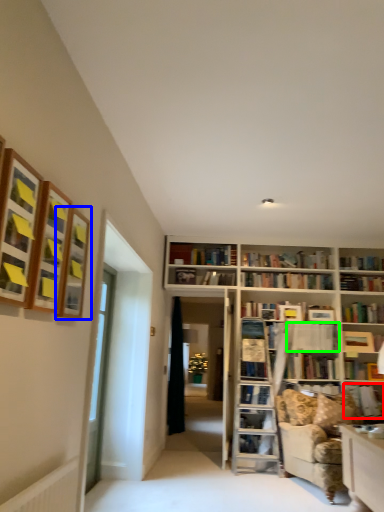
Question: Which is farther away from book (highlighted by a red box)? shelf (highlighted by a blue box) or book (highlighted by a green box)?

Choices:
 (A) shelf
 (B) book

Answer: (A)